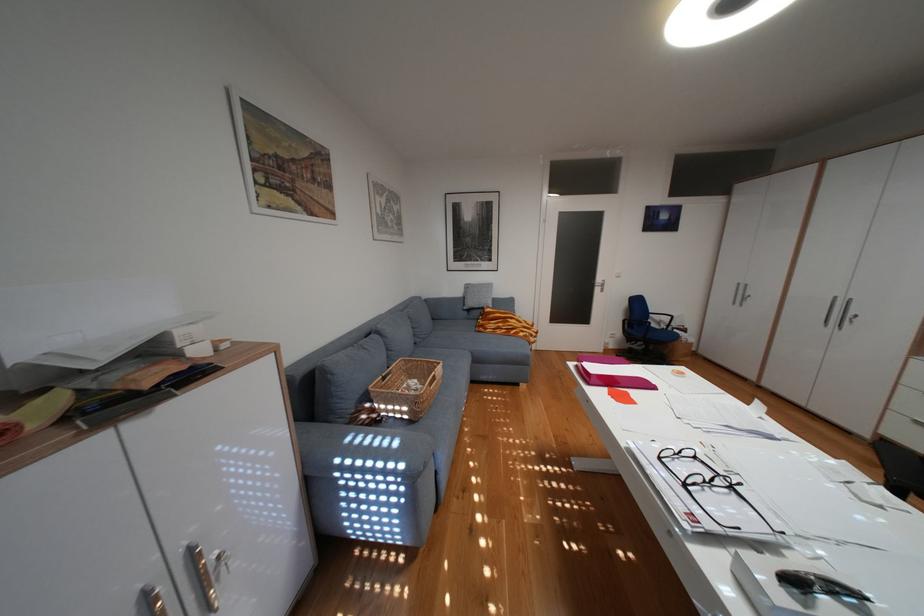
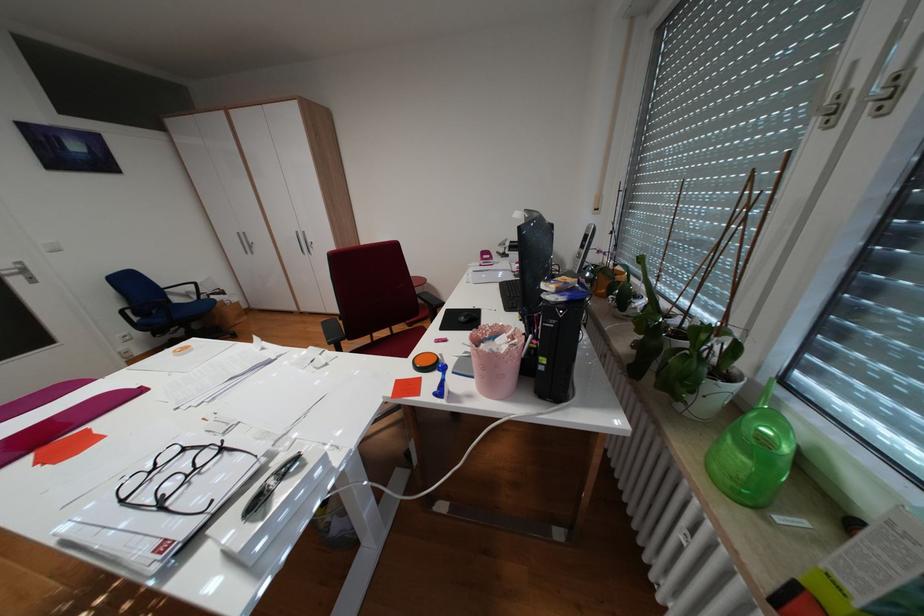
In the second image, find the point that corresponds to point 797,552 in the first image.

(285, 464)